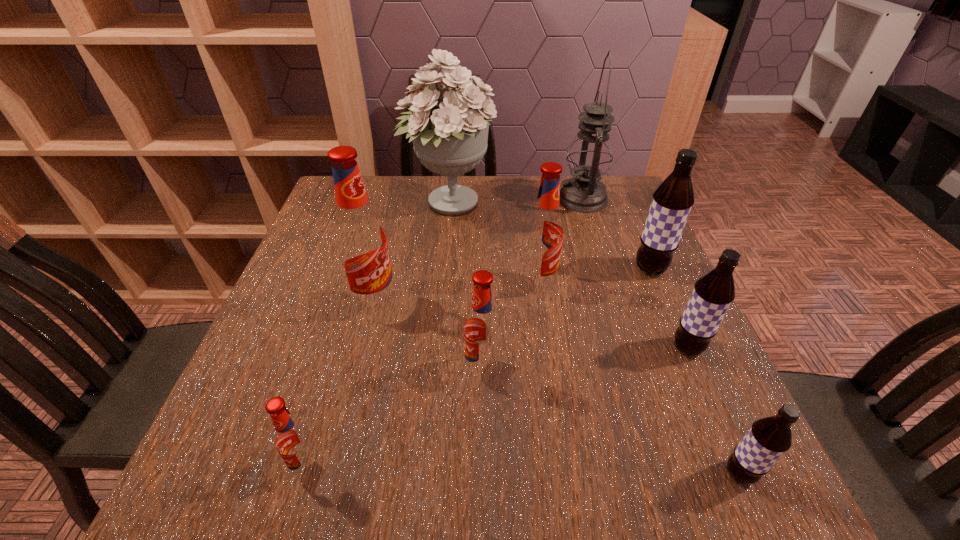
The image size is (960, 540). I want to click on gray oil lamp, so click(x=589, y=158).

I want to click on green bouquet, so (450, 139).

Find the location of a particular element. Image resolution: width=960 pixels, height=540 pixels. the biggest red root beer is located at coordinates (360, 238).

Locate an element on the screen. Image resolution: width=960 pixels, height=540 pixels. the second biggest red root beer is located at coordinates (543, 236).

Identify the location of the rightmost red root beer. (543, 236).

Where is `the biggest brown root beer`? the biggest brown root beer is located at coordinates (672, 201).

Locate an element on the screen. This screenshot has width=960, height=540. the third red root beer from left to right is located at coordinates (482, 328).

Locate an element on the screen. The height and width of the screenshot is (540, 960). the second smallest red root beer is located at coordinates (482, 328).

Image resolution: width=960 pixels, height=540 pixels. What are the coordinates of `the second biggest brown root beer` in the screenshot? It's located at (713, 293).

Locate an element on the screen. The width and height of the screenshot is (960, 540). the smallest red root beer is located at coordinates (294, 441).